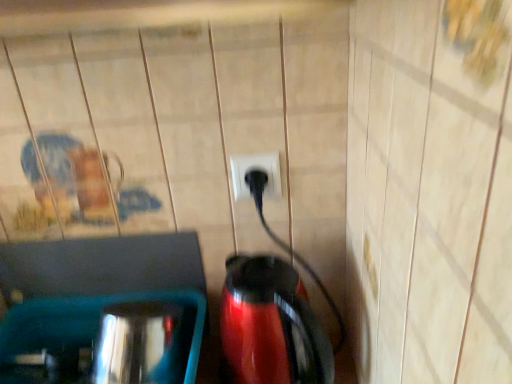
Question: From a real-world perspective, is glossy plastic coffee pot at center positioned above or below black plastic plug at center?

Choices:
 (A) below
 (B) above

Answer: (A)

Question: In terms of size, does glossy plastic coffee pot at center appear bigger or smaller than black plastic plug at center?

Choices:
 (A) big
 (B) small

Answer: (A)

Question: Considering the positions of point (287, 340) and point (239, 157), is point (287, 340) closer or farther from the camera than point (239, 157)?

Choices:
 (A) closer
 (B) farther

Answer: (A)

Question: Considering the positions of black plastic plug at center and glossy plastic coffee pot at center in the image, is black plastic plug at center wider or thinner than glossy plastic coffee pot at center?

Choices:
 (A) wide
 (B) thin

Answer: (B)

Question: Is black plastic plug at center in front of or behind glossy plastic coffee pot at center in the image?

Choices:
 (A) behind
 (B) front

Answer: (A)

Question: From the image's perspective, is black plastic plug at center positioned above or below glossy plastic coffee pot at center?

Choices:
 (A) above
 (B) below

Answer: (A)

Question: Considering the positions of black plastic plug at center and glossy plastic coffee pot at center in the image, is black plastic plug at center bigger or smaller than glossy plastic coffee pot at center?

Choices:
 (A) big
 (B) small

Answer: (B)